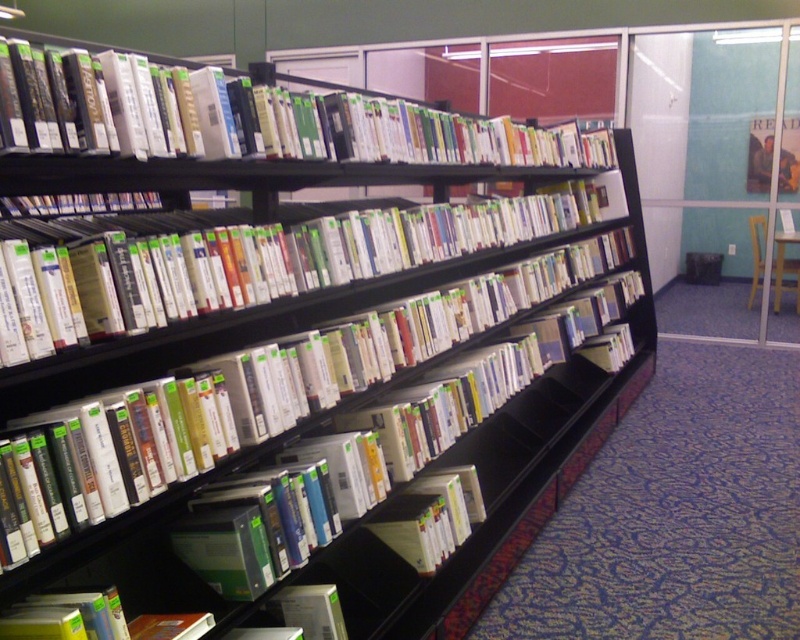
Who is positioned more to the left, hardcover books at upper center or hardcover books at center?

hardcover books at center

Is hardcover books at upper center wider than hardcover books at center?

Indeed, hardcover books at upper center has a greater width compared to hardcover books at center.

Between point (310, 122) and point (472, 216), which one is positioned in front?

Positioned in front is point (310, 122).

You are a GUI agent. You are given a task and a screenshot of the screen. Output one action in this format:
    pyautogui.click(x=<x>, y=<y>)
    Task: Click on the hardcover books at upper center
    This screenshot has width=800, height=640.
    Given the screenshot: What is the action you would take?
    pyautogui.click(x=300, y=125)